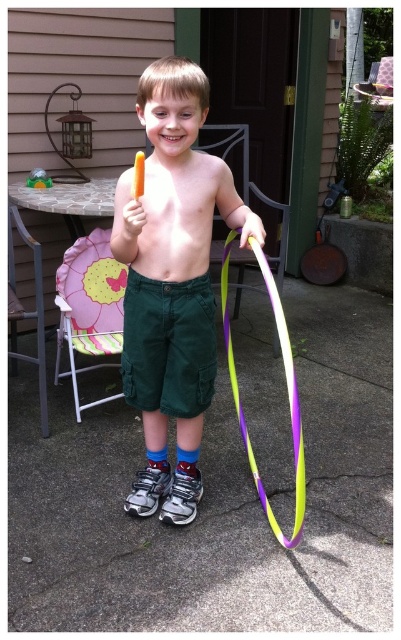
Question: Which object appears farthest from the camera in this image?

Choices:
 (A) green cotton shorts at center
 (B) matte green shorts at center
 (C) dark green cotton shorts at center

Answer: (C)

Question: Is dark green cotton shorts at center to the left of green plastic toy at center from the viewer's perspective?

Choices:
 (A) yes
 (B) no

Answer: (B)

Question: Observing the image, what is the correct spatial positioning of green cotton shorts at center in reference to green plastic toy at center?

Choices:
 (A) below
 (B) above

Answer: (A)

Question: Which point is closer to the camera taking this photo?

Choices:
 (A) (180, 280)
 (B) (32, 177)
 (C) (251, 465)
 (D) (125, 301)

Answer: (A)

Question: Which point is closer to the camera taking this photo?

Choices:
 (A) (202, 282)
 (B) (295, 419)
 (C) (200, 349)
 (D) (40, 180)

Answer: (B)

Question: Does dark green cotton shorts at center have a smaller size compared to green cotton shorts at center?

Choices:
 (A) no
 (B) yes

Answer: (A)